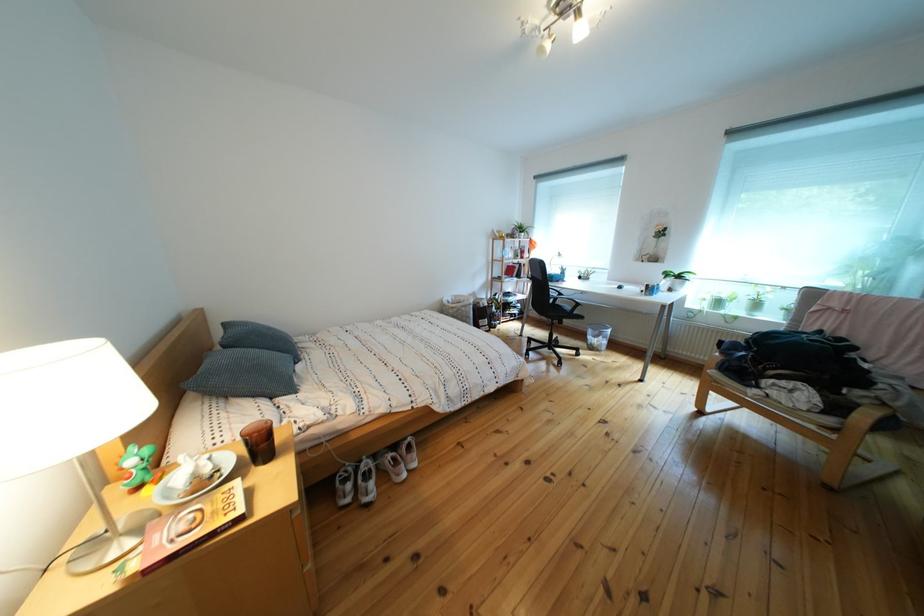
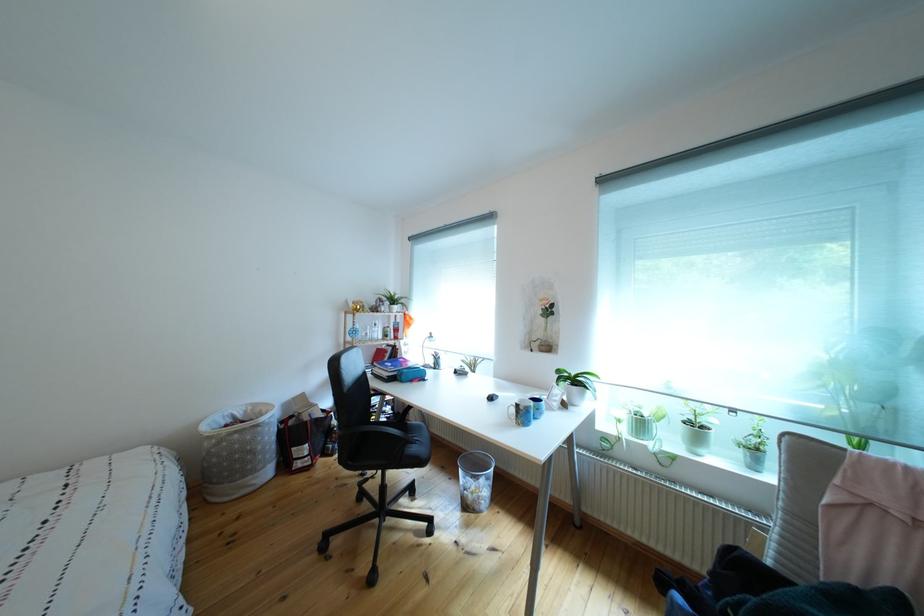
Which direction would the cameraman need to move to produce the second image?

The cameraman walked toward right, forward.